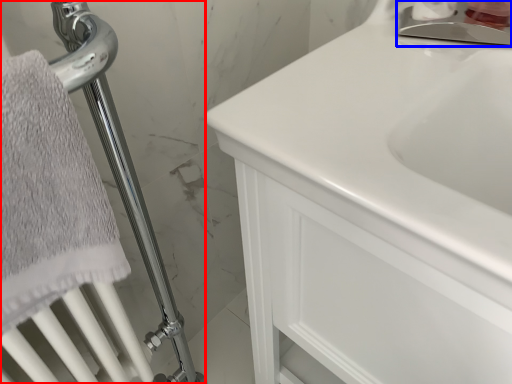
Question: Which object is further to the camera taking this photo, shower (highlighted by a red box) or faucet (highlighted by a blue box)?

Choices:
 (A) shower
 (B) faucet

Answer: (B)